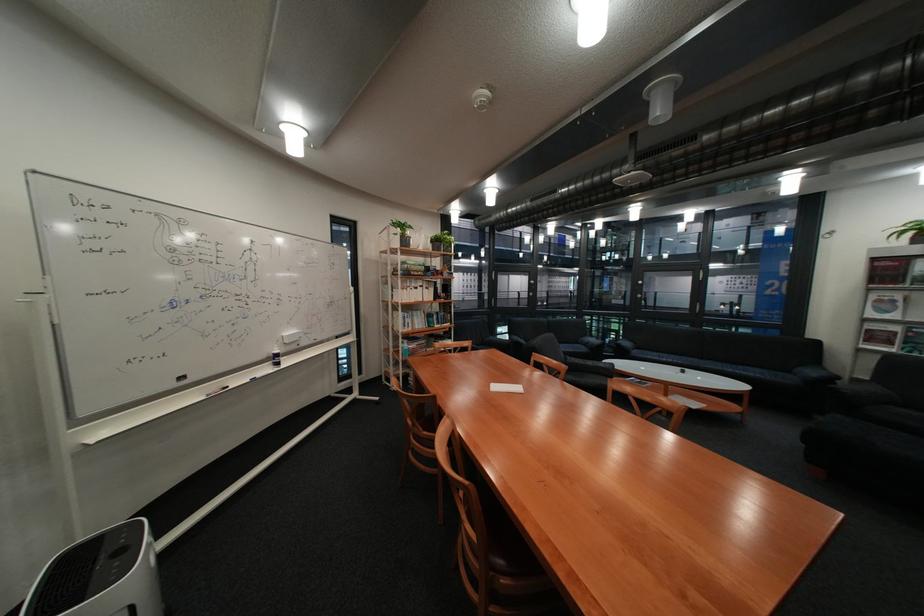
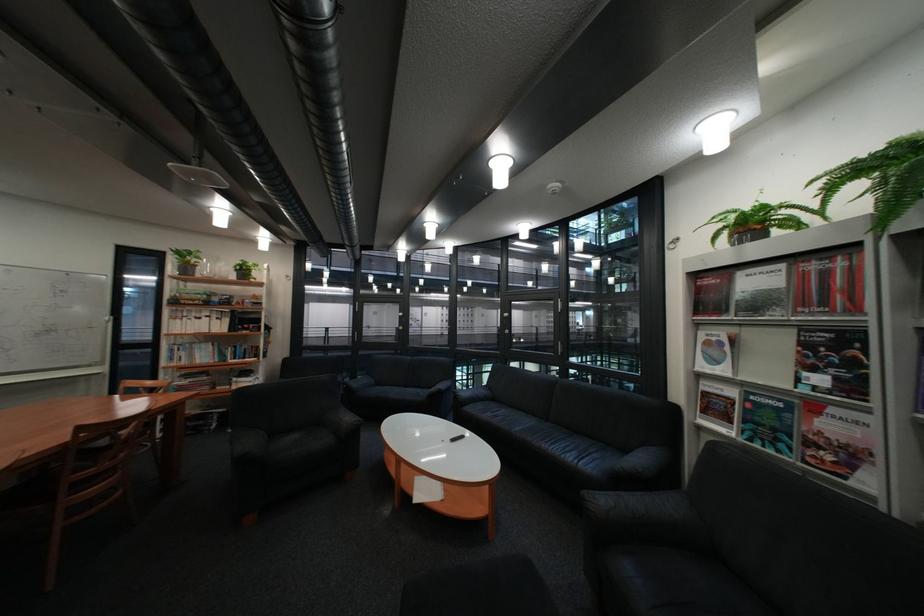
Question: The images are taken continuously from a first-person perspective. In which direction are you moving?

Choices:
 (A) Left
 (B) Right
 (C) Forward
 (D) Backward

Answer: (B)